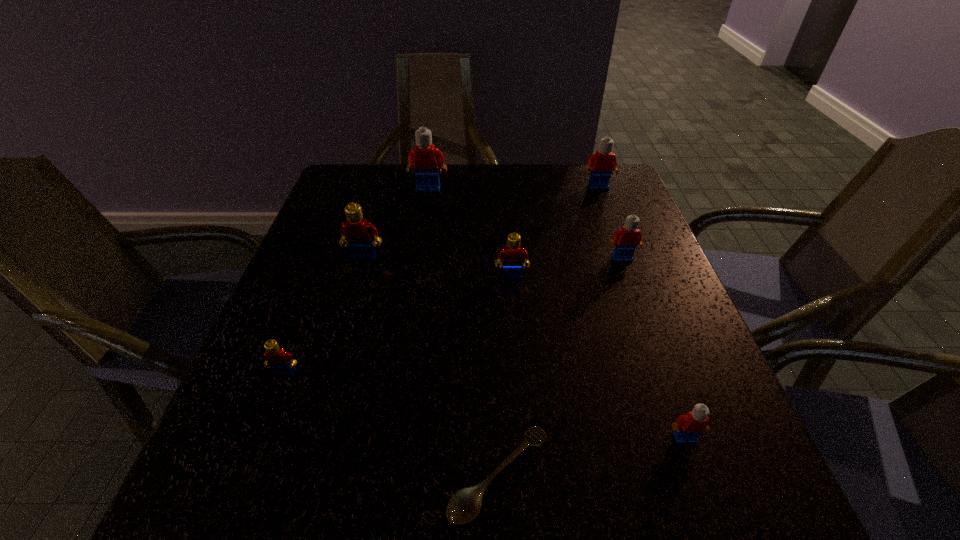
Identify which object is the sixth nearest to the seventh object from right to left. Please provide its 2D coordinates. Your answer should be formatted as a tuple, i.e. [(x, y)], where the tuple contains the x and y coordinates of a point satisfying the conditions above.

[(603, 163)]

The height and width of the screenshot is (540, 960). I want to click on Lego that is the sixth closest to the third smallest white Lego, so click(x=281, y=362).

The image size is (960, 540). I want to click on Lego that is the second closest to the biggest red Lego, so click(x=426, y=158).

Find the location of a particular element. white Lego identified as the fourth closest to the leftmost Lego is located at coordinates (603, 163).

I want to click on the third closest white Lego to the fourth Lego from left to right, so (x=603, y=163).

Select which red Lego is the closest to the farthest red Lego. Please provide its 2D coordinates. Your answer should be formatted as a tuple, i.e. [(x, y)], where the tuple contains the x and y coordinates of a point satisfying the conditions above.

[(511, 255)]

Where is `red Lego that is the third closest to the nearest white Lego`? This screenshot has height=540, width=960. red Lego that is the third closest to the nearest white Lego is located at coordinates (357, 233).

Identify the location of vacant region that satisfies the following two spatial constraints: 1. on the face of the ladle; 2. on the left side of the tallest Lego. The width and height of the screenshot is (960, 540). (382, 475).

Image resolution: width=960 pixels, height=540 pixels. Identify the location of free location that satisfies the following two spatial constraints: 1. on the front-facing side of the ladle; 2. on the left side of the nearest red Lego. pos(246,475).